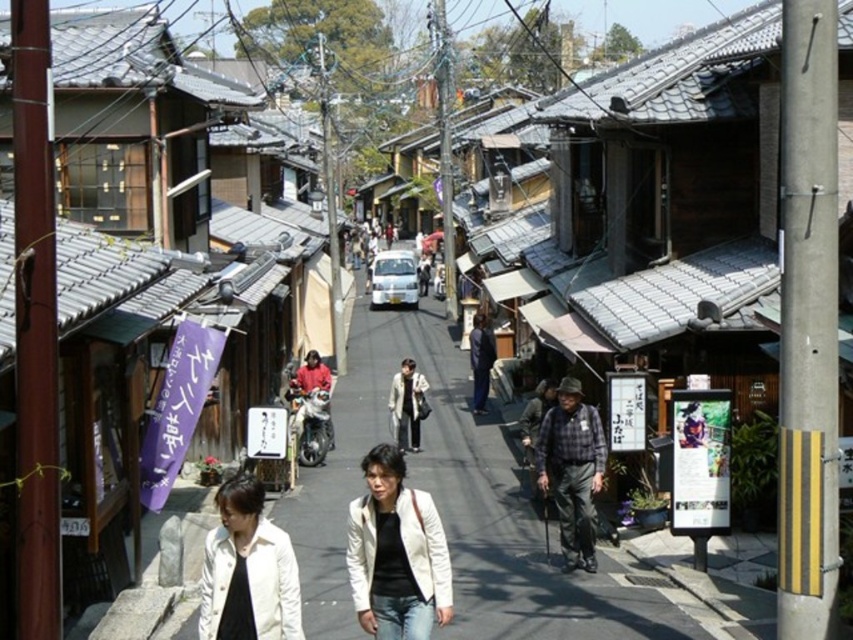
You are a delivery person who needs to quickly pass through the narrow alleyway. You see a white leather jacket at center and a shiny silver motorcycle at center. Which object should you move around to navigate safely?

The white leather jacket at center is positioned on the right side of the shiny silver motorcycle at center. Since the alleyway is narrow, you should move around the shiny silver motorcycle at center first as it is larger and stationary, allowing you to pass safely between the motorcycle and the jacket.

You are a tourist walking down the narrow alleyway and notice the plaid fabric hat at center and the shiny silver motorcycle at center. Which object is closer to you?

The plaid fabric hat at center is closer to you because it is in front of the shiny silver motorcycle at center.

Looking at this image, you are a tailor observing two jackets in a crowded street scene. The jackets are the white matte jacket at lower center and the light beige jacket at center. Which jacket would require less fabric to make?

The white matte jacket at lower center requires less fabric because it is thinner than the light beige jacket at center.